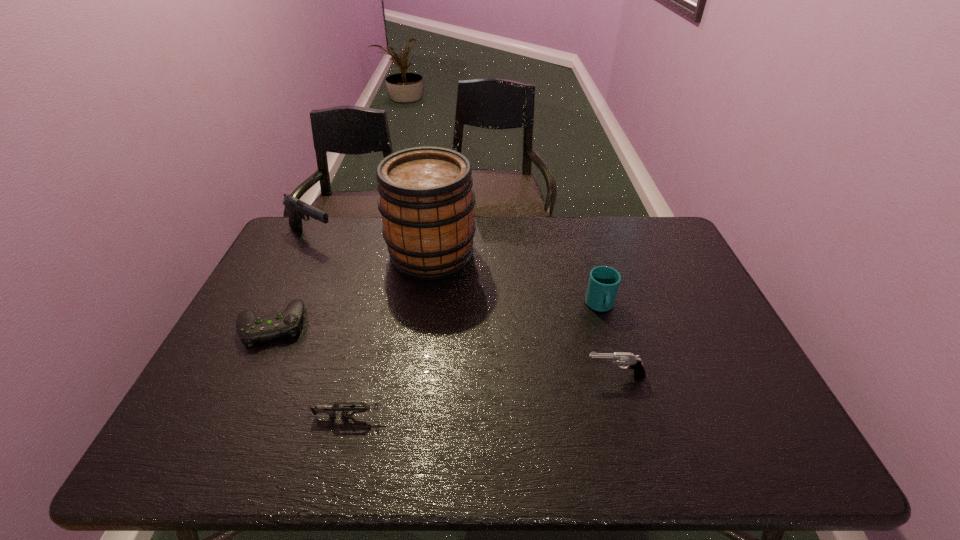
Image resolution: width=960 pixels, height=540 pixels. Identify the location of cider. (426, 200).

I want to click on the tallest gun, so click(x=297, y=209).

Find the location of a particular element. The image size is (960, 540). the second tallest object is located at coordinates (297, 209).

Locate an element on the screen. cup is located at coordinates (603, 284).

Image resolution: width=960 pixels, height=540 pixels. I want to click on the second shortest gun, so click(634, 362).

The height and width of the screenshot is (540, 960). I want to click on the second farthest gun, so click(634, 362).

Image resolution: width=960 pixels, height=540 pixels. Identify the location of the nearest gun. (358, 407).

Where is `the nearest object`? This screenshot has width=960, height=540. the nearest object is located at coordinates click(x=358, y=407).

At what (x,y) coordinates should I click in order to perform the action: click on control. Please return your answer as a coordinate pair (x, y). The height and width of the screenshot is (540, 960). Looking at the image, I should click on (251, 329).

I want to click on vacant area situated on the left of the cider, so click(x=346, y=254).